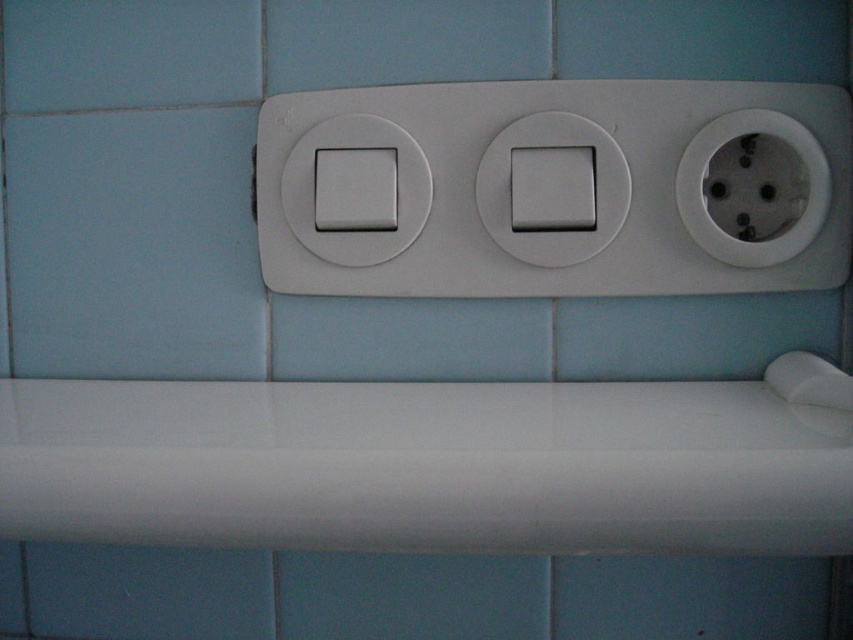
You are an electrician working on a light switch installation. You need to locate the white plastic light switch at center. Where exactly is it located on the wall?

The white plastic light switch at center is located at point coordinates of (625,200).

You are a painter who needs to paint the blue matte tile at lower center and the white plastic socket at right. Which object will require you to reach further away from your current position?

The white plastic socket at right is further away from the viewer than the blue matte tile at lower center, so you will need to reach further to paint the white plastic socket at right.

You are an electrician inspecting the tiled wall. You notice the white plastic light switch at center and the blue matte tile at lower center. Which object is closer to you from your current viewpoint?

The white plastic light switch at center is closer to you because it is in front of the blue matte tile at lower center.